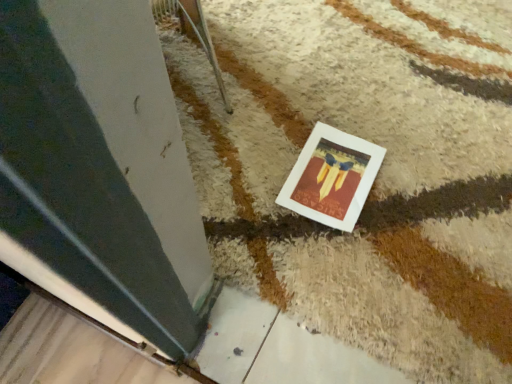
At what (x,y) coordinates should I click in order to perform the action: click on white paper at center. Please return your answer as a coordinate pair (x, y). Looking at the image, I should click on (332, 177).

Describe the element at coordinates (332, 177) in the screenshot. I see `white paper at center` at that location.

Identify the location of white paper at center. (332, 177).